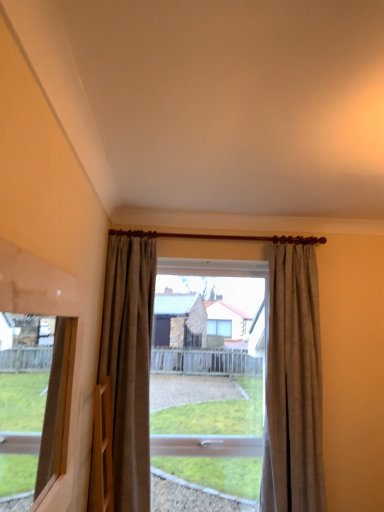
Question: From a real-world perspective, is transparent glass window at center positioned under matte brown curtain at center, arranged as the 1th curtain when viewed from the left, based on gravity?

Choices:
 (A) no
 (B) yes

Answer: (B)

Question: Is transparent glass window at center bigger than matte brown curtain at center, arranged as the 1th curtain when viewed from the left?

Choices:
 (A) no
 (B) yes

Answer: (B)

Question: Does transparent glass window at center have a greater width compared to matte brown curtain at center, arranged as the 1th curtain when viewed from the left?

Choices:
 (A) no
 (B) yes

Answer: (A)

Question: Is transparent glass window at center looking in the opposite direction of matte brown curtain at center, positioned as the second curtain in right-to-left order?

Choices:
 (A) no
 (B) yes

Answer: (A)

Question: Does transparent glass window at center appear on the left side of matte brown curtain at center, positioned as the second curtain in right-to-left order?

Choices:
 (A) no
 (B) yes

Answer: (A)

Question: From a real-world perspective, is matte brown curtain at center, positioned as the second curtain in right-to-left order, above or below beige textured curtain at center, which appears as the second curtain when viewed from the left?

Choices:
 (A) below
 (B) above

Answer: (A)

Question: From the image's perspective, relative to beige textured curtain at center, acting as the 1th curtain starting from the right, is matte brown curtain at center, arranged as the 1th curtain when viewed from the left, above or below?

Choices:
 (A) above
 (B) below

Answer: (A)

Question: Is matte brown curtain at center, positioned as the second curtain in right-to-left order, inside or outside of beige textured curtain at center, acting as the 1th curtain starting from the right?

Choices:
 (A) outside
 (B) inside

Answer: (A)

Question: Looking at their shapes, would you say matte brown curtain at center, positioned as the second curtain in right-to-left order, is wider or thinner than beige textured curtain at center, acting as the 1th curtain starting from the right?

Choices:
 (A) wide
 (B) thin

Answer: (B)

Question: From the image's perspective, is wooden frame at left above or below matte brown curtain at center, arranged as the 1th curtain when viewed from the left?

Choices:
 (A) below
 (B) above

Answer: (B)

Question: Would you say wooden frame at left is inside or outside matte brown curtain at center, arranged as the 1th curtain when viewed from the left?

Choices:
 (A) inside
 (B) outside

Answer: (B)

Question: Considering the positions of wooden frame at left and matte brown curtain at center, arranged as the 1th curtain when viewed from the left, in the image, is wooden frame at left taller or shorter than matte brown curtain at center, arranged as the 1th curtain when viewed from the left,?

Choices:
 (A) tall
 (B) short

Answer: (B)

Question: Considering the positions of wooden frame at left and matte brown curtain at center, arranged as the 1th curtain when viewed from the left, in the image, is wooden frame at left bigger or smaller than matte brown curtain at center, arranged as the 1th curtain when viewed from the left,?

Choices:
 (A) small
 (B) big

Answer: (A)

Question: Considering their positions, is transparent glass window at center located in front of or behind wooden frame at left?

Choices:
 (A) front
 (B) behind

Answer: (B)

Question: In the image, is transparent glass window at center on the left side or the right side of wooden frame at left?

Choices:
 (A) left
 (B) right

Answer: (B)